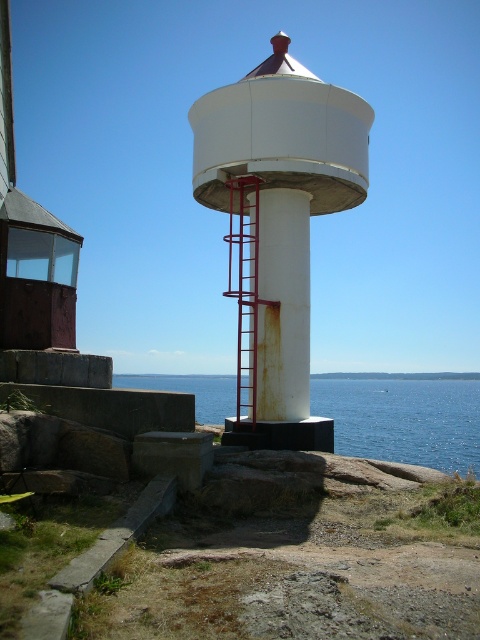
In the scene shown: You are a drone operator tasked with taking aerial photos of the white matte water tower at center. The drone must maintain a minimum altitude of 100 meters to avoid detection. Given the coordinates of the water tower at point 0.352, 0.579, can you confirm if the drone will be able to capture the entire structure without obstruction?

The white matte water tower at center is positioned at coordinates (277, 225). Since the drone must maintain a minimum altitude of 100 meters, it should be able to capture the entire structure without obstruction as long as the altitude is sufficient to encompass the tower within the camera frame.

You are a maintenance worker needing to reach the top of the rusty metal pillar at center to inspect it. You have the metallic red ladder at center available. Based on their heights, will the ladder be sufficient to reach the top of the pillar?

The rusty metal pillar at center is not as tall as the metallic red ladder at center, so the ladder is tall enough to reach the top of the pillar.

You are a tourist standing on the rocky terrain near the white matte water tower at center and the blue water at center. Which object is located to your right?

The white matte water tower at center is positioned on the right side of blue water at center, so the white matte water tower at center is to your right.